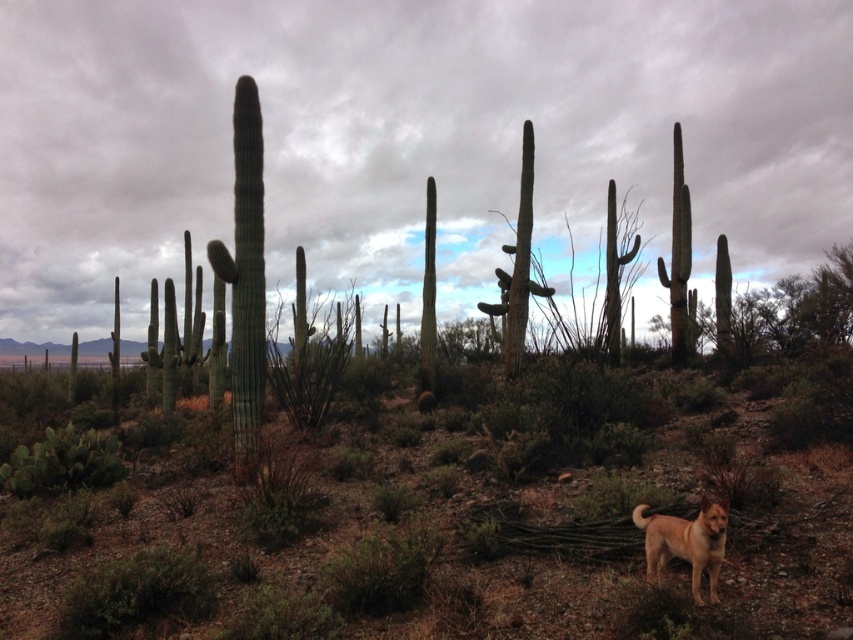
Based on the photo, you are a photographer trying to capture the golden fur dog at lower right and the green matte cactus at center in the same frame. Based on their positions, which object would appear closer to the camera?

The golden fur dog at lower right appears closer to the camera because it is positioned above the green matte cactus at center, which is below it.

You are a photographer positioned at the center of the desert scene. You want to capture a closeup shot of the green matte cactus at center. Given your current position, in which direction should you move to get closer to the cactus?

The green matte cactus at center is located at point (x=416, y=540) in 2D coordinates. Since you are at the center of the scene, you should move towards the right and slightly upwards to reach the cactus.

Consider the image. You are a photographer trying to capture the green matte cactus at center and the golden fur dog at lower right in a single shot. Based on their positions, which object would appear closer to the camera in the photo?

The green matte cactus at center appears closer to the camera because it is positioned in front of the golden fur dog at lower right.